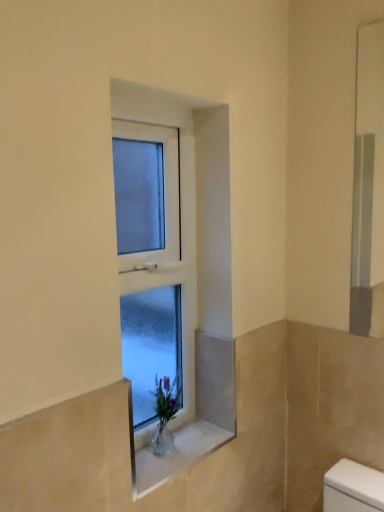
Where is `white frosted glass window at center`? white frosted glass window at center is located at coordinates (173, 273).

This screenshot has width=384, height=512. What do you see at coordinates (173, 273) in the screenshot?
I see `white frosted glass window at center` at bounding box center [173, 273].

The image size is (384, 512). What do you see at coordinates (177, 454) in the screenshot?
I see `clear glass vase at center` at bounding box center [177, 454].

I want to click on clear glass vase at center, so click(177, 454).

What are the coordinates of `white frosted glass window at center` in the screenshot? It's located at (173, 273).

Would you say white frosted glass window at center is to the left or to the right of clear glass vase at center in the picture?

Clearly, white frosted glass window at center is on the left of clear glass vase at center in the image.

In the scene shown: Is white frosted glass window at center closer to camera compared to clear glass vase at center?

That is True.

Which is closer, (130, 167) or (185, 459)?

The point (185, 459) is closer to the camera.

Looking at this image, from the image's perspective, is white frosted glass window at center positioned above or below clear glass vase at center?

Based on their image positions, white frosted glass window at center is located above clear glass vase at center.

From a real-world perspective, is white frosted glass window at center physically located above or below clear glass vase at center?

Clearly, from a real-world perspective, white frosted glass window at center is above clear glass vase at center.

Looking at this image, considering the relative sizes of white frosted glass window at center and clear glass vase at center in the image provided, is white frosted glass window at center wider than clear glass vase at center?

In fact, white frosted glass window at center might be narrower than clear glass vase at center.

Who is shorter, white frosted glass window at center or clear glass vase at center?

clear glass vase at center is shorter.

Consider the image. In terms of size, does white frosted glass window at center appear bigger or smaller than clear glass vase at center?

Considering their sizes, white frosted glass window at center takes up more space than clear glass vase at center.

Is white frosted glass window at center outside of clear glass vase at center?

Yes, white frosted glass window at center is located beyond the bounds of clear glass vase at center.

Is white frosted glass window at center far from clear glass vase at center?

white frosted glass window at center is actually quite close to clear glass vase at center.

Is white frosted glass window at center turned away from clear glass vase at center?

No, white frosted glass window at center is not facing away from clear glass vase at center.

Identify the location of window lying in front of the clear glass vase at center. (173, 273).

Is clear glass vase at center to the right of white frosted glass window at center from the viewer's perspective?

Yes.

Is clear glass vase at center in front of white frosted glass window at center?

No, it is behind white frosted glass window at center.

Which is in front, point (170, 468) or point (194, 159)?

Point (170, 468)

From the image's perspective, relative to white frosted glass window at center, is clear glass vase at center above or below?

From the image's perspective, clear glass vase at center appears below white frosted glass window at center.

From a real-world perspective, which is physically below, clear glass vase at center or white frosted glass window at center?

clear glass vase at center is physically lower.

Considering the sizes of objects clear glass vase at center and white frosted glass window at center in the image provided, who is thinner, clear glass vase at center or white frosted glass window at center?

white frosted glass window at center is thinner.

Does clear glass vase at center have a greater height compared to white frosted glass window at center?

Incorrect, the height of clear glass vase at center is not larger of that of white frosted glass window at center.

Considering the relative sizes of clear glass vase at center and white frosted glass window at center in the image provided, is clear glass vase at center bigger than white frosted glass window at center?

No, clear glass vase at center is not bigger than white frosted glass window at center.

Is clear glass vase at center positioned beyond the bounds of white frosted glass window at center?

Yes, clear glass vase at center is outside of white frosted glass window at center.

Would you say clear glass vase at center is a long distance from white frosted glass window at center?

No, clear glass vase at center is in close proximity to white frosted glass window at center.

Is clear glass vase at center facing away from white frosted glass window at center?

No, clear glass vase at center is not facing the opposite direction of white frosted glass window at center.

Can you tell me how much clear glass vase at center and white frosted glass window at center differ in facing direction?

The angle between the facing direction of clear glass vase at center and the facing direction of white frosted glass window at center is 0.000102 degrees.

This screenshot has height=512, width=384. I want to click on window sill behind the white frosted glass window at center, so click(x=177, y=454).

You are a GUI agent. You are given a task and a screenshot of the screen. Output one action in this format:
    pyautogui.click(x=<x>, y=<y>)
    Task: Click on the window sill below the white frosted glass window at center (from a real-world perspective)
    
    Given the screenshot: What is the action you would take?
    pyautogui.click(x=177, y=454)

The height and width of the screenshot is (512, 384). Find the location of `window sill that appears behind the white frosted glass window at center`. window sill that appears behind the white frosted glass window at center is located at coordinates (177, 454).